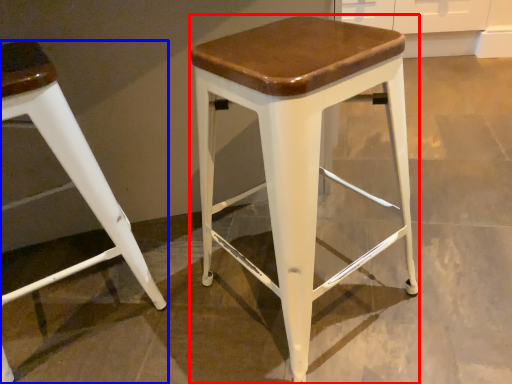
Question: Among these objects, which one is farthest to the camera, stool (highlighted by a red box) or stool (highlighted by a blue box)?

Choices:
 (A) stool
 (B) stool

Answer: (B)